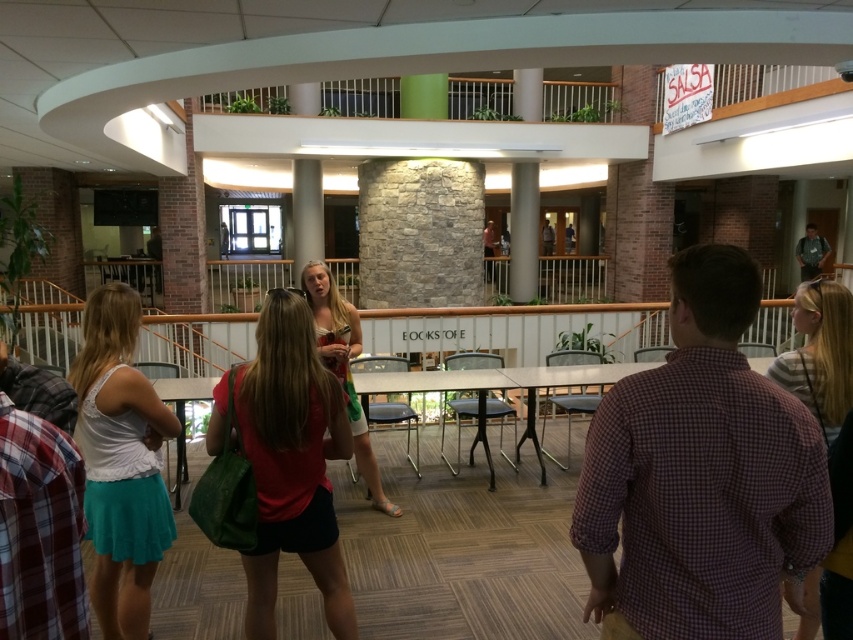
You are standing in the scene and want to greet the person wearing the plaid cotton shirt at upper right. To reach them from the matte white tank top at center, should you walk to your left or right?

The plaid cotton shirt at upper right is to the right of the matte white tank top at center, so you should walk to your right to reach them.

What are the coordinates of the matte green bag at center?

The coordinates of the matte green bag at center are at point (291, 461).

You are organizing a photo shoot and need to ensure that all clothing items in the scene are visible. Given that the plaid cotton shirt at upper right and the matte white tank top at center are both in the frame, which clothing item might require adjustment to ensure it is fully visible?

The plaid cotton shirt at upper right occupies less space than the matte white tank top at center, so it might require adjustment to ensure it is fully visible.